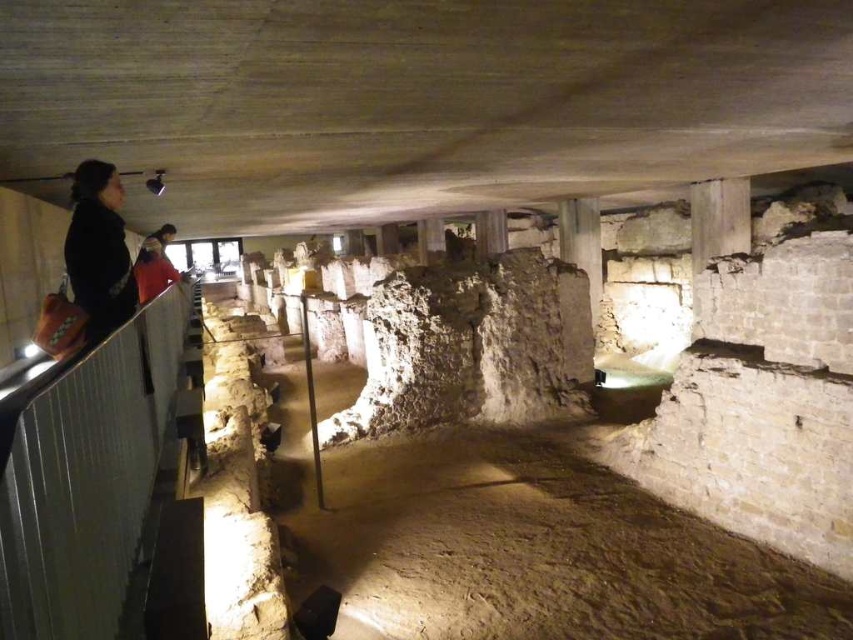
Question: Is metal/rustic rail at left to the left of black fabric bag at upper left from the viewer's perspective?

Choices:
 (A) yes
 (B) no

Answer: (B)

Question: In this image, where is metal/rustic rail at left located relative to black fabric bag at upper left?

Choices:
 (A) left
 (B) right

Answer: (B)

Question: Based on their relative distances, which object is farther from the black fabric bag at upper left?

Choices:
 (A) metal/rustic rail at left
 (B) orange fabric jacket at upper left

Answer: (B)

Question: Is metal/rustic rail at left thinner than black fabric bag at upper left?

Choices:
 (A) yes
 (B) no

Answer: (B)

Question: Considering the real-world distances, which object is closest to the orange fabric jacket at upper left?

Choices:
 (A) black fabric bag at upper left
 (B) metal/rustic rail at left

Answer: (A)

Question: Among these points, which one is nearest to the camera?

Choices:
 (A) (137, 256)
 (B) (103, 218)
 (C) (78, 392)

Answer: (C)